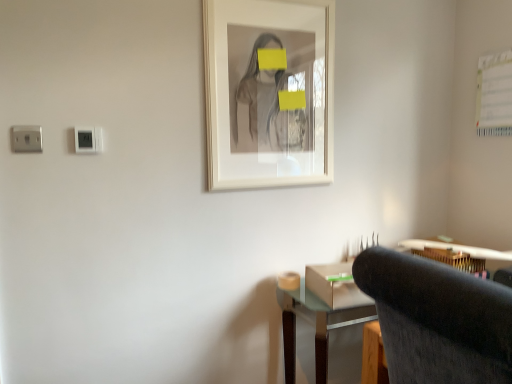
Question: Is white plastic electric outlet at upper left located outside dark gray fabric chair at lower right?

Choices:
 (A) yes
 (B) no

Answer: (A)

Question: Does white plastic electric outlet at upper left lie in front of dark gray fabric chair at lower right?

Choices:
 (A) no
 (B) yes

Answer: (A)

Question: Is the surface of white plastic electric outlet at upper left in direct contact with dark gray fabric chair at lower right?

Choices:
 (A) no
 (B) yes

Answer: (A)

Question: Does white plastic electric outlet at upper left appear on the left side of dark gray fabric chair at lower right?

Choices:
 (A) no
 (B) yes

Answer: (B)

Question: Is there a large distance between white plastic electric outlet at upper left and dark gray fabric chair at lower right?

Choices:
 (A) no
 (B) yes

Answer: (B)

Question: Is white plastic electric outlet at upper left to the right of dark gray fabric chair at lower right from the viewer's perspective?

Choices:
 (A) no
 (B) yes

Answer: (A)

Question: Is wooden desk at lower right closer to the viewer compared to white plastic electric outlet at upper left?

Choices:
 (A) no
 (B) yes

Answer: (A)

Question: Can you confirm if wooden desk at lower right is positioned to the right of white plastic electric outlet at upper left?

Choices:
 (A) no
 (B) yes

Answer: (B)

Question: Is wooden desk at lower right not inside white plastic electric outlet at upper left?

Choices:
 (A) yes
 (B) no

Answer: (A)

Question: Is wooden desk at lower right facing away from white plastic electric outlet at upper left?

Choices:
 (A) no
 (B) yes

Answer: (A)

Question: Considering the relative sizes of wooden desk at lower right and white plastic electric outlet at upper left in the image provided, is wooden desk at lower right wider than white plastic electric outlet at upper left?

Choices:
 (A) yes
 (B) no

Answer: (A)

Question: Does wooden desk at lower right touch white plastic electric outlet at upper left?

Choices:
 (A) no
 (B) yes

Answer: (A)

Question: From the image's perspective, is wooden desk at lower right under dark gray fabric chair at lower right?

Choices:
 (A) no
 (B) yes

Answer: (A)